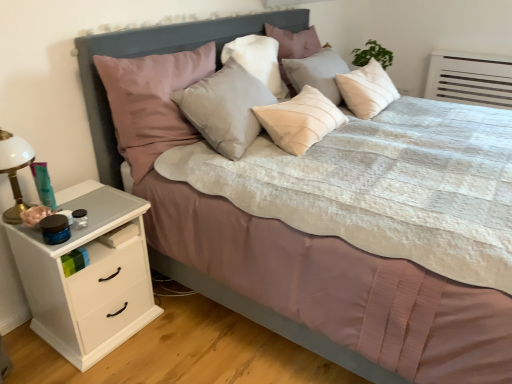
Question: From a real-world perspective, is white glass lamp at left positioned above or below velvet pink pillow at upper left, arranged as the 1th pillow when viewed from the left?

Choices:
 (A) below
 (B) above

Answer: (A)

Question: Considering the relative positions of white glass lamp at left and velvet pink pillow at upper left, arranged as the 1th pillow when viewed from the left, in the image provided, is white glass lamp at left to the left or to the right of velvet pink pillow at upper left, arranged as the 1th pillow when viewed from the left,?

Choices:
 (A) right
 (B) left

Answer: (B)

Question: Which object is the closest to the matte gray headboard at center?

Choices:
 (A) light beige fabric pillow at center, which appears as the 3th pillow when viewed from the left
 (B) matte gray pillow at center, the second pillow when ordered from right to left
 (C) white glass lamp at left
 (D) white matte chest of drawers at left
 (E) velvet pink pillow at upper left, the third pillow positioned from the right

Answer: (E)

Question: Which is farther from the matte gray pillow at center, the second pillow when ordered from right to left?

Choices:
 (A) velvet pink pillow at upper left, the third pillow positioned from the right
 (B) matte gray headboard at center
 (C) white glass lamp at left
 (D) light beige fabric pillow at center, which ranks as the 1th pillow in right-to-left order
 (E) white matte chest of drawers at left

Answer: (C)